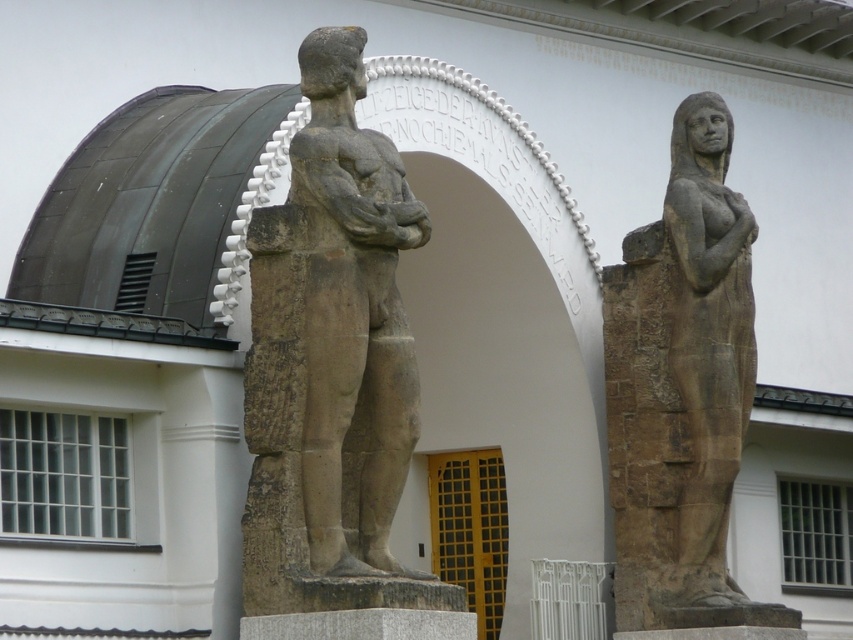
You are an art student observing the statues in front of the building. You notice that the stone statue at center and the brown stone statue at right are part of your study. Which statue is smaller in size?

The stone statue at center is smaller in size compared to the brown stone statue at right.

You are standing in front of the building and notice two points marked on the statues. The first point is at coordinates point (312, 330) and the second is at point (654, 324). Which point is closer to you?

Point (312, 330) is closer to the viewer than point (654, 324).

You are standing in front of the building and notice two points marked on the statues. The first point is at coordinates point (x=653, y=314) and the second is at point (x=688, y=170). Which point is closer to you?

Point (x=653, y=314) is closer to the camera than point (x=688, y=170).